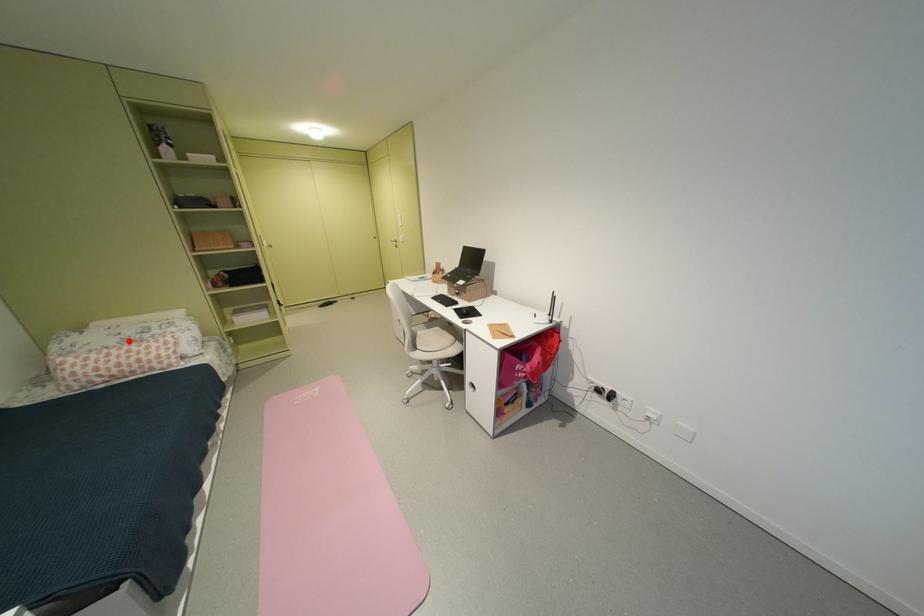
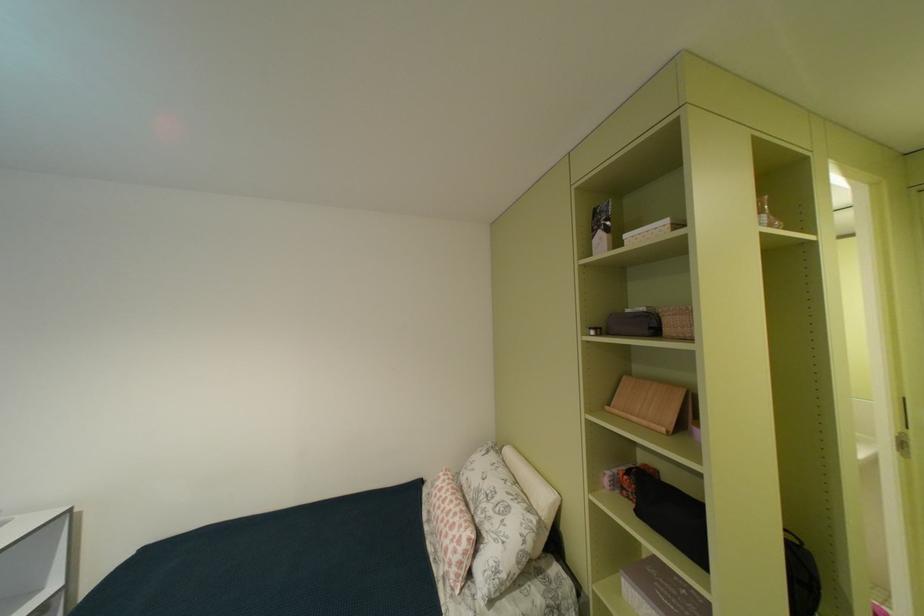
Question: I am providing you with two images of the same scene from different viewpoints. A red point is marked on the first image. At the location where the point appears in image 1, is it still visible in image 2?

Choices:
 (A) Yes
 (B) No

Answer: (A)